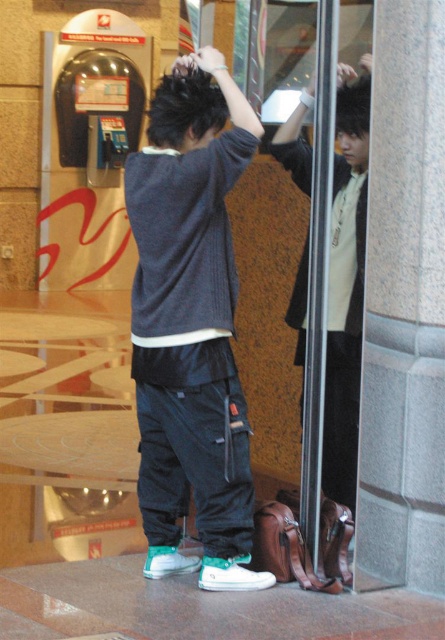
Question: Is dark gray sweater at center further to the viewer compared to matte black jacket at center?

Choices:
 (A) no
 (B) yes

Answer: (A)

Question: From the image, what is the correct spatial relationship of dark gray sweater at center in relation to matte black jacket at center?

Choices:
 (A) left
 (B) right

Answer: (A)

Question: Does dark gray sweater at center have a smaller size compared to matte black jacket at center?

Choices:
 (A) no
 (B) yes

Answer: (A)